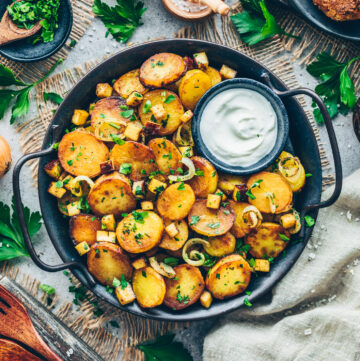
The height and width of the screenshot is (361, 360). In order to click on small plate in this screenshot , I will do `click(130, 82)`, `click(60, 30)`.